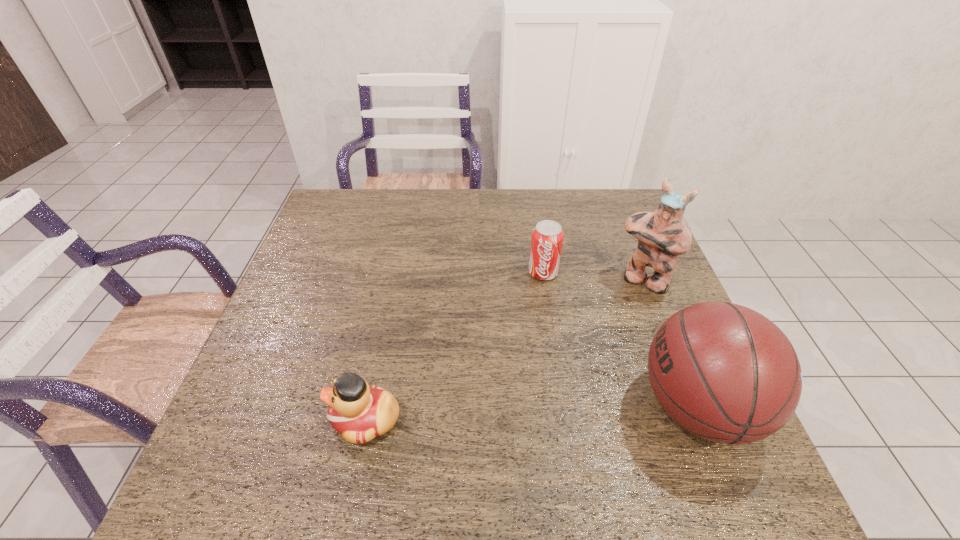
Where is `the leftmost object`? This screenshot has height=540, width=960. the leftmost object is located at coordinates (359, 412).

What are the coordinates of `duck` in the screenshot? It's located at (359, 412).

Identify the location of the second tallest object. (722, 371).

Locate an element on the screen. The width and height of the screenshot is (960, 540). soda can is located at coordinates (547, 237).

You are a GUI agent. You are given a task and a screenshot of the screen. Output one action in this format:
    pyautogui.click(x=<x>, y=<y>)
    Task: Click on the figurine
    
    Given the screenshot: What is the action you would take?
    tap(662, 235)

The image size is (960, 540). I want to click on vacant space positioned 0.070m on the face of the leftmost object, so 297,420.

At what (x,y) coordinates should I click in order to perform the action: click on blank space located 0.160m on the face of the leftmost object. Please return your answer as a coordinate pair (x, y). The height and width of the screenshot is (540, 960). Looking at the image, I should click on (252, 420).

In order to click on blank space located on the face of the leftmost object in this screenshot , I will do `click(272, 420)`.

You are a GUI agent. You are given a task and a screenshot of the screen. Output one action in this format:
    pyautogui.click(x=<x>, y=<y>)
    Task: Click on the free point located on the left of the third shortest object
    
    Given the screenshot: What is the action you would take?
    pyautogui.click(x=560, y=407)

Where is `vacant position located 0.090m on the logo side of the third object from right to left`? This screenshot has width=960, height=540. vacant position located 0.090m on the logo side of the third object from right to left is located at coordinates (537, 306).